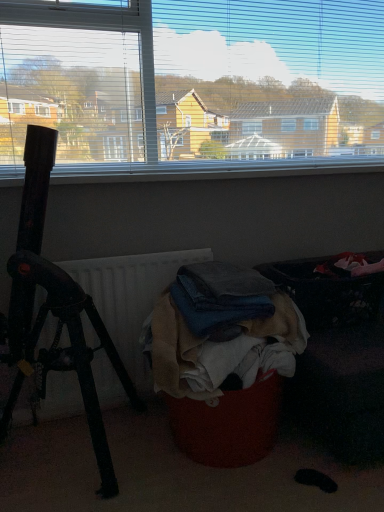
Question: Is black matte tripod at left at the left side of textured fabric laundry basket at lower right?

Choices:
 (A) no
 (B) yes

Answer: (B)

Question: From the image's perspective, is black matte tripod at left under textured fabric laundry basket at lower right?

Choices:
 (A) no
 (B) yes

Answer: (A)

Question: Would you say black matte tripod at left is a long distance from textured fabric laundry basket at lower right?

Choices:
 (A) yes
 (B) no

Answer: (B)

Question: Can you confirm if black matte tripod at left is bigger than textured fabric laundry basket at lower right?

Choices:
 (A) no
 (B) yes

Answer: (A)

Question: Can you confirm if black matte tripod at left is thinner than textured fabric laundry basket at lower right?

Choices:
 (A) no
 (B) yes

Answer: (B)

Question: Is black matte tripod at left closer to the viewer compared to textured fabric laundry basket at lower right?

Choices:
 (A) yes
 (B) no

Answer: (A)

Question: Can you confirm if black matte tripod at left is bigger than denim fabric clothes at center?

Choices:
 (A) no
 (B) yes

Answer: (B)

Question: From a real-world perspective, does black matte tripod at left sit lower than denim fabric clothes at center?

Choices:
 (A) no
 (B) yes

Answer: (A)

Question: Considering the relative positions of black matte tripod at left and denim fabric clothes at center in the image provided, is black matte tripod at left to the right of denim fabric clothes at center from the viewer's perspective?

Choices:
 (A) no
 (B) yes

Answer: (A)

Question: From the image's perspective, would you say black matte tripod at left is shown under denim fabric clothes at center?

Choices:
 (A) no
 (B) yes

Answer: (A)

Question: Can you confirm if black matte tripod at left is wider than denim fabric clothes at center?

Choices:
 (A) yes
 (B) no

Answer: (A)

Question: Could denim fabric clothes at center be considered to be inside black matte tripod at left?

Choices:
 (A) no
 (B) yes

Answer: (A)

Question: Is textured fabric laundry basket at lower right thinner than denim fabric clothes at center?

Choices:
 (A) yes
 (B) no

Answer: (B)